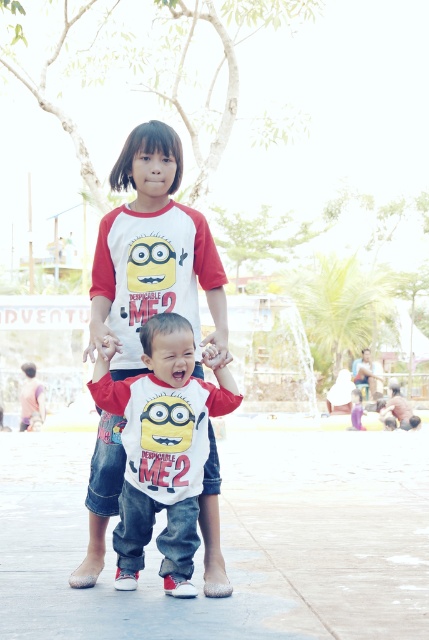
Question: Does concrete at center come in front of white matte shirt at center?

Choices:
 (A) no
 (B) yes

Answer: (B)

Question: Among these points, which one is farthest from the camera?

Choices:
 (A) (199, 397)
 (B) (392, 636)

Answer: (A)

Question: Does concrete at center appear under white matte shirt at center?

Choices:
 (A) no
 (B) yes

Answer: (B)

Question: Which point is farther to the camera?

Choices:
 (A) white matte shirt at center
 (B) concrete at center

Answer: (A)

Question: Does concrete at center appear on the right side of white matte shirt at center?

Choices:
 (A) no
 (B) yes

Answer: (A)